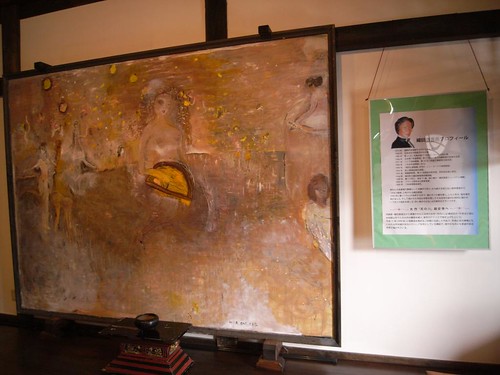
Locate an element on the screen. shadow on the wall is located at coordinates (358, 220).